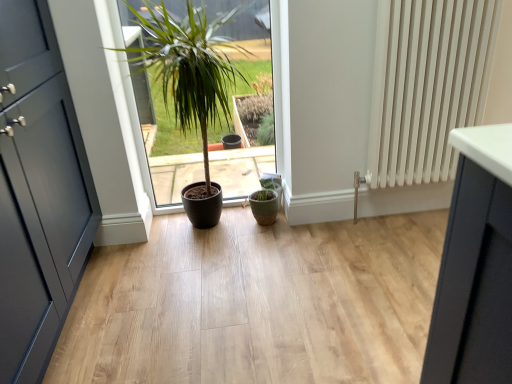
Question: Should I look upward or downward to see matte green flowerpot at center?

Choices:
 (A) down
 (B) up

Answer: (A)

Question: Is white ribbed radiator at right looking in the opposite direction of matte brown pot at center?

Choices:
 (A) no
 (B) yes

Answer: (A)

Question: Can you confirm if white ribbed radiator at right is wider than matte brown pot at center?

Choices:
 (A) no
 (B) yes

Answer: (A)

Question: Is white ribbed radiator at right outside matte brown pot at center?

Choices:
 (A) yes
 (B) no

Answer: (A)

Question: Is white ribbed radiator at right oriented towards matte brown pot at center?

Choices:
 (A) yes
 (B) no

Answer: (B)

Question: From a real-world perspective, is white ribbed radiator at right beneath matte brown pot at center?

Choices:
 (A) yes
 (B) no

Answer: (B)

Question: Is white ribbed radiator at right at the right side of matte brown pot at center?

Choices:
 (A) yes
 (B) no

Answer: (A)

Question: From a real-world perspective, is matte green flowerpot at center positioned over matte dark blue door at left based on gravity?

Choices:
 (A) no
 (B) yes

Answer: (A)

Question: Is matte green flowerpot at center outside of matte dark blue door at left?

Choices:
 (A) no
 (B) yes

Answer: (B)

Question: Considering the relative sizes of matte green flowerpot at center and matte dark blue door at left in the image provided, is matte green flowerpot at center wider than matte dark blue door at left?

Choices:
 (A) yes
 (B) no

Answer: (B)

Question: Is matte green flowerpot at center closer to the viewer compared to matte dark blue door at left?

Choices:
 (A) yes
 (B) no

Answer: (B)

Question: Would you consider matte green flowerpot at center to be distant from matte dark blue door at left?

Choices:
 (A) yes
 (B) no

Answer: (A)

Question: Does matte green flowerpot at center have a greater height compared to matte dark blue door at left?

Choices:
 (A) no
 (B) yes

Answer: (A)

Question: Considering the relative sizes of matte brown pot at center and white ribbed radiator at right in the image provided, is matte brown pot at center bigger than white ribbed radiator at right?

Choices:
 (A) no
 (B) yes

Answer: (B)